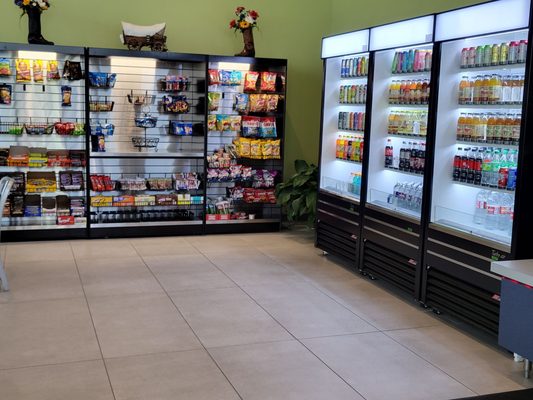
Where is `refrigerators`? This screenshot has height=400, width=533. refrigerators is located at coordinates (355, 104), (403, 121), (491, 148).